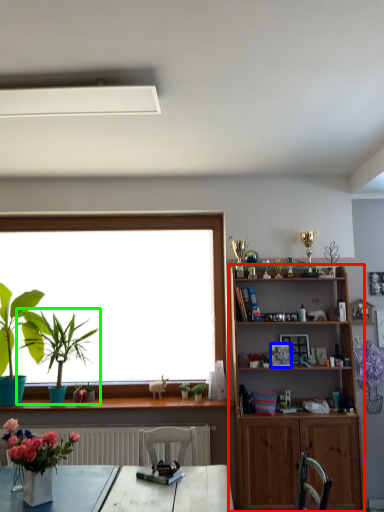
Question: Which object is positioned closest to shelf (highlighted by a red box)? Select from picture frame (highlighted by a blue box) and houseplant (highlighted by a green box).

Choices:
 (A) picture frame
 (B) houseplant

Answer: (A)